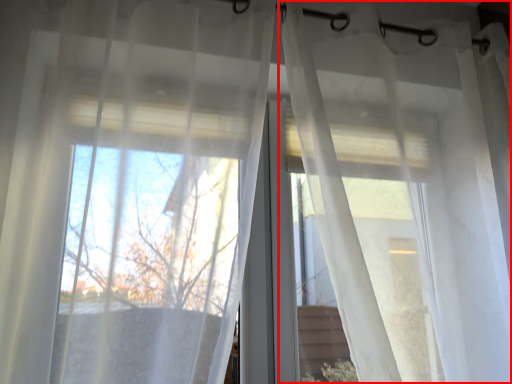
Question: From the image's perspective, what is the correct spatial relationship of curtain (annotated by the red box) in relation to curtain?

Choices:
 (A) below
 (B) above

Answer: (A)